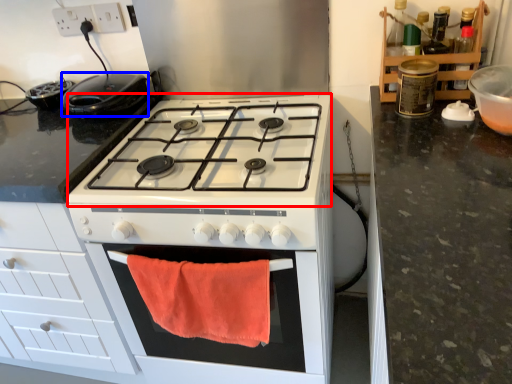
Question: Which object is further to the camera taking this photo, gas stove (highlighted by a red box) or kitchen appliance (highlighted by a blue box)?

Choices:
 (A) gas stove
 (B) kitchen appliance

Answer: (B)